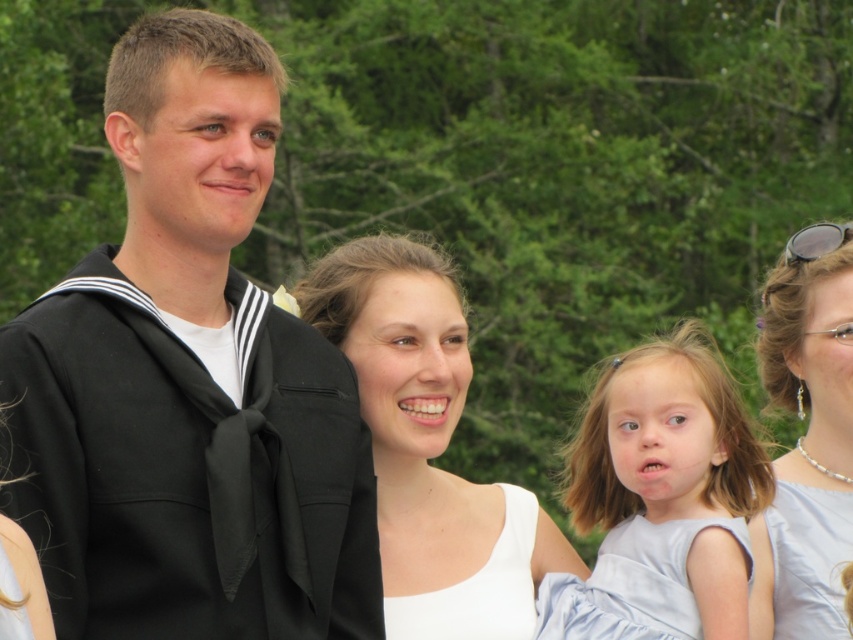
Question: Which object appears farthest from the camera in this image?

Choices:
 (A) light blue satin dress at lower right
 (B) sailor uniform at left

Answer: (A)

Question: Which object is closer to the camera taking this photo?

Choices:
 (A) pearl necklace at upper right
 (B) light blue satin dress at lower right

Answer: (B)

Question: Does light blue fabric dress at lower right have a greater width compared to sunglasses at upper right?

Choices:
 (A) no
 (B) yes

Answer: (A)

Question: Considering the real-world distances, which object is farthest from the white satin dress at lower right?

Choices:
 (A) sunglasses at upper right
 (B) light blue satin dress at lower right

Answer: (A)

Question: Is white satin dress at lower right positioned at the back of white matte tank top at center?

Choices:
 (A) no
 (B) yes

Answer: (B)

Question: Can you confirm if white matte tank top at center is thinner than sunglasses at upper right?

Choices:
 (A) yes
 (B) no

Answer: (A)